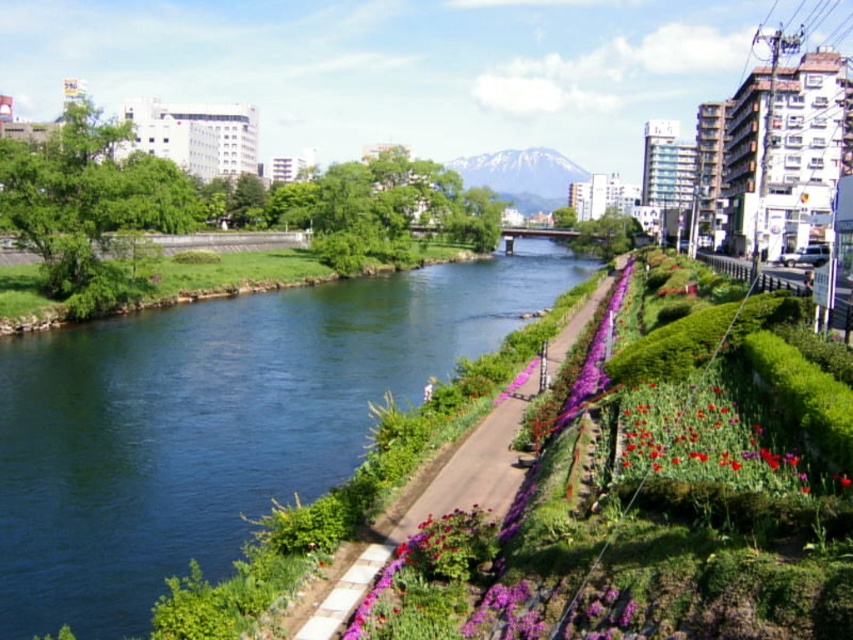
Which is in front, point (115, 500) or point (381, 545)?

Positioned in front is point (381, 545).

Between green smooth water at center and green grassy path at center, which one is positioned lower?

Positioned lower is green grassy path at center.

Who is more distant from viewer, (50, 476) or (514, 456)?

Point (50, 476)

This screenshot has height=640, width=853. What are the coordinates of `green smooth water at center` in the screenshot? It's located at (213, 422).